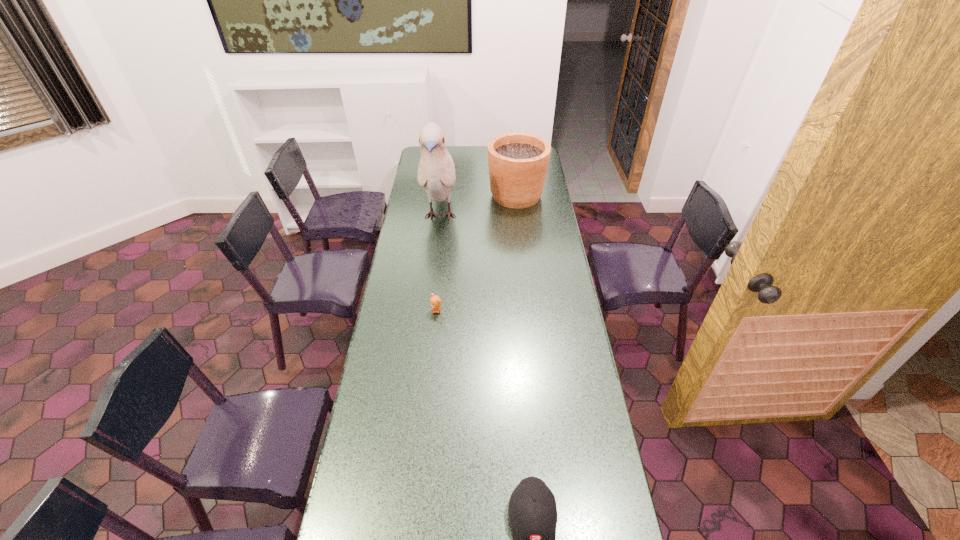
Locate which object ranks second in proximity to the shortest object. Please provide its 2D coordinates. Your answer should be formatted as a tuple, i.e. [(x, y)], where the tuple contains the x and y coordinates of a point satisfying the conditions above.

[(518, 162)]